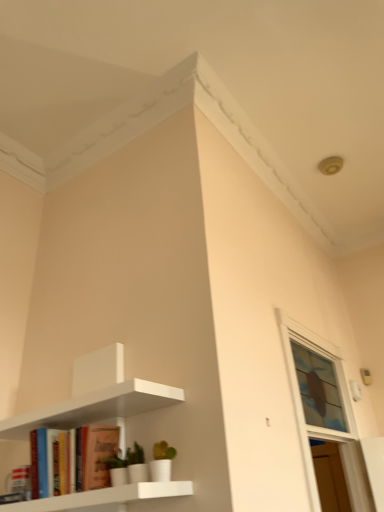
Question: Can you confirm if white matte shelf at upper left is wider than clear glass window at upper right?

Choices:
 (A) no
 (B) yes

Answer: (B)

Question: Can you confirm if white matte shelf at upper left is smaller than clear glass window at upper right?

Choices:
 (A) no
 (B) yes

Answer: (A)

Question: Is white matte shelf at upper left bigger than clear glass window at upper right?

Choices:
 (A) no
 (B) yes

Answer: (B)

Question: Can you confirm if white matte shelf at upper left is thinner than clear glass window at upper right?

Choices:
 (A) no
 (B) yes

Answer: (A)

Question: Can we say white matte shelf at upper left lies outside clear glass window at upper right?

Choices:
 (A) yes
 (B) no

Answer: (A)

Question: In terms of width, does clear glass window at upper right look wider or thinner when compared to matte orange book at lower left?

Choices:
 (A) wide
 (B) thin

Answer: (A)

Question: Considering the relative positions of clear glass window at upper right and matte orange book at lower left in the image provided, is clear glass window at upper right to the left or to the right of matte orange book at lower left?

Choices:
 (A) left
 (B) right

Answer: (B)

Question: From the image's perspective, is clear glass window at upper right above or below matte orange book at lower left?

Choices:
 (A) above
 (B) below

Answer: (A)

Question: Is point (347, 413) closer or farther from the camera than point (87, 487)?

Choices:
 (A) farther
 (B) closer

Answer: (A)

Question: Is point (109, 433) positioned closer to the camera than point (322, 377)?

Choices:
 (A) farther
 (B) closer

Answer: (B)

Question: Based on their sizes in the image, would you say matte orange book at lower left is bigger or smaller than clear glass window at upper right?

Choices:
 (A) small
 (B) big

Answer: (A)

Question: Relative to clear glass window at upper right, is matte orange book at lower left in front or behind?

Choices:
 (A) front
 (B) behind

Answer: (A)

Question: Choose the correct answer: Is matte orange book at lower left inside clear glass window at upper right or outside it?

Choices:
 (A) outside
 (B) inside

Answer: (A)

Question: Is white matte shelf at upper left taller or shorter than matte orange book at lower left?

Choices:
 (A) short
 (B) tall

Answer: (B)

Question: Is point (142, 386) positioned closer to the camera than point (92, 424)?

Choices:
 (A) closer
 (B) farther

Answer: (A)